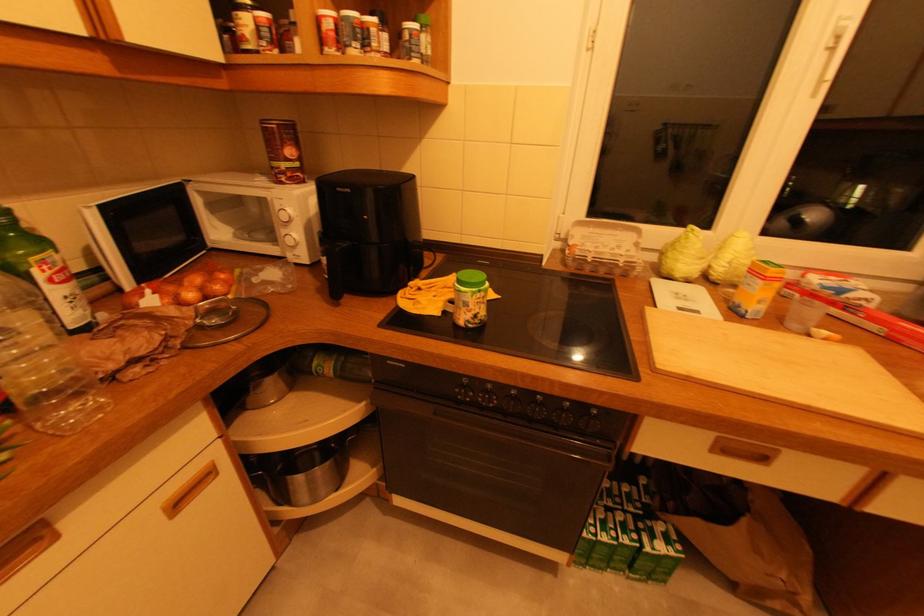
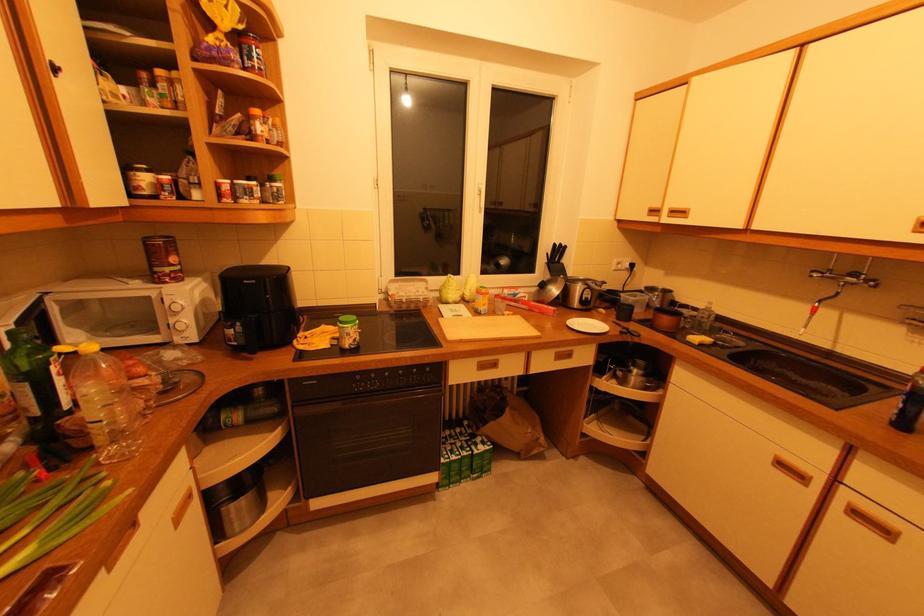
In the second image, find the point that corresponds to point 38,272 in the first image.

(55, 368)